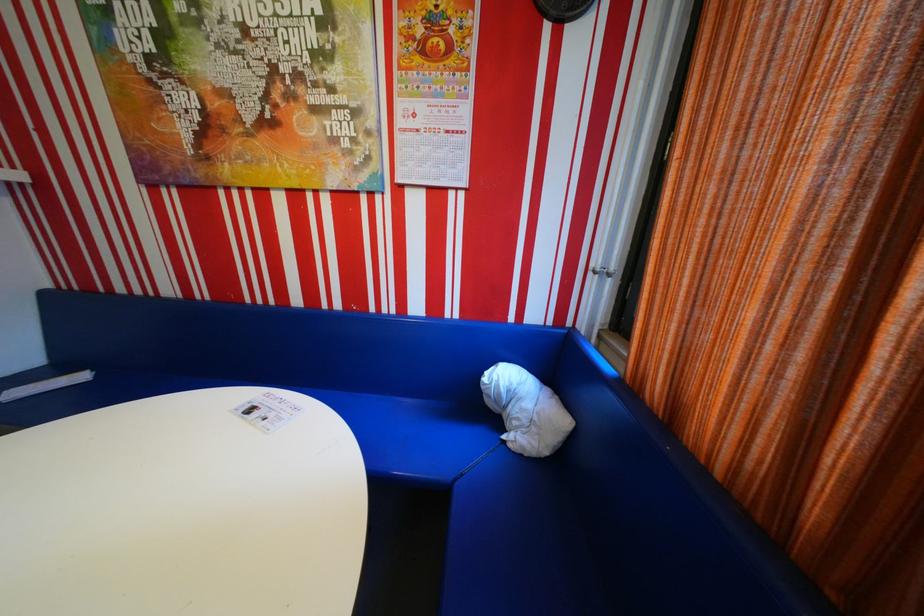
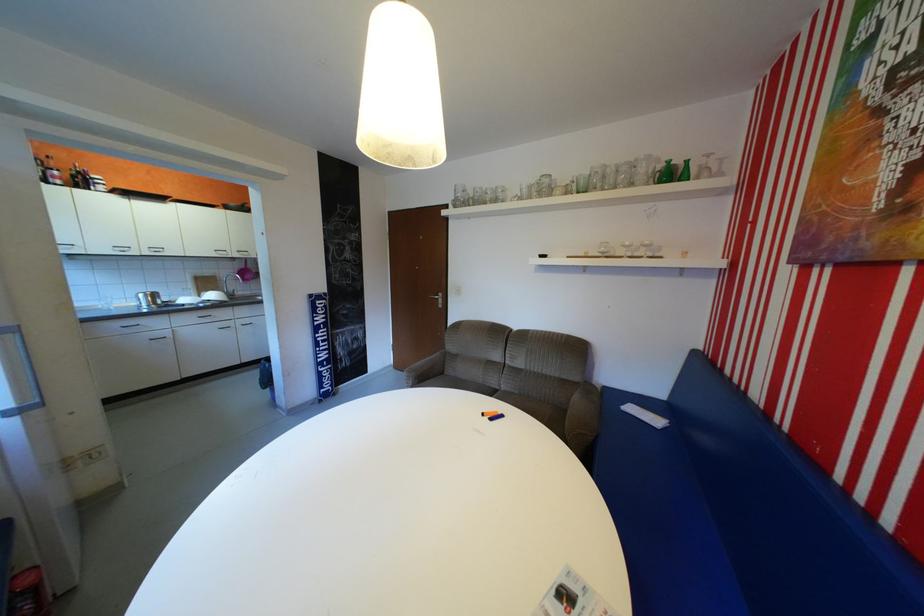
First-person continuous shooting, in which direction is the camera rotating?

The rotation direction of the camera is left-down.